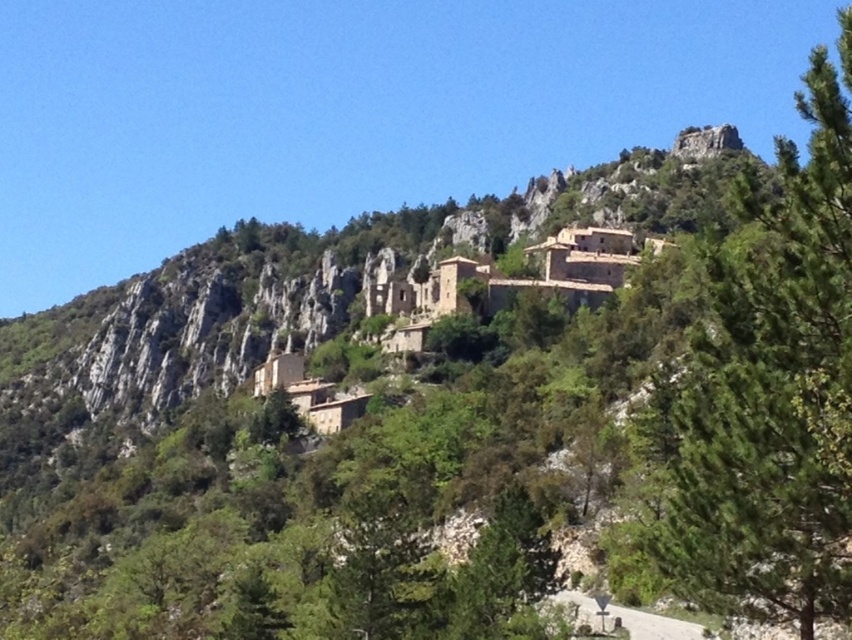
Is point (691, 432) in front of point (582, 285)?

Yes, point (691, 432) is closer to viewer.

Who is more forward, (695, 394) or (275, 385)?

Positioned in front is point (695, 394).

Who is more forward, [849,106] or [553,269]?

Point [849,106] is more forward.

Find the location of `green leafy tree at upper right`. green leafy tree at upper right is located at coordinates (770, 388).